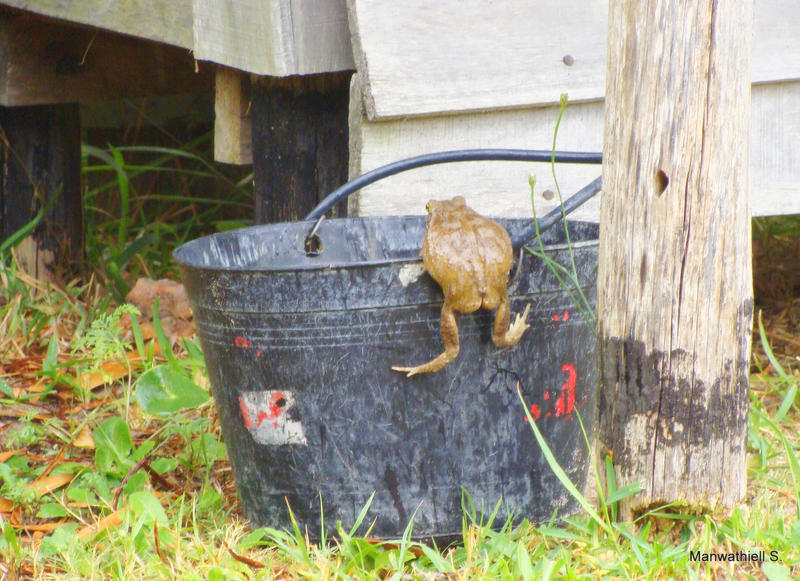
The image size is (800, 581). I want to click on handle, so click(x=521, y=153).